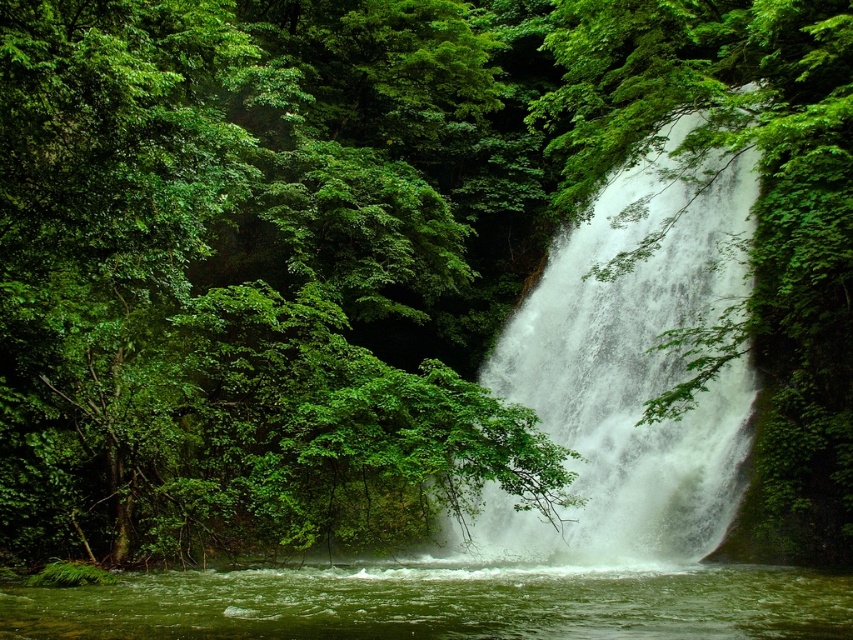
Question: Which of the following is the farthest from the observer?

Choices:
 (A) white frothy water at center
 (B) green liquid water at lower center

Answer: (A)

Question: Does white frothy water at center appear on the right side of green liquid water at lower center?

Choices:
 (A) no
 (B) yes

Answer: (B)

Question: Can you confirm if white frothy water at center is positioned to the right of green liquid water at lower center?

Choices:
 (A) yes
 (B) no

Answer: (A)

Question: Is white frothy water at center positioned at the back of green liquid water at lower center?

Choices:
 (A) yes
 (B) no

Answer: (A)